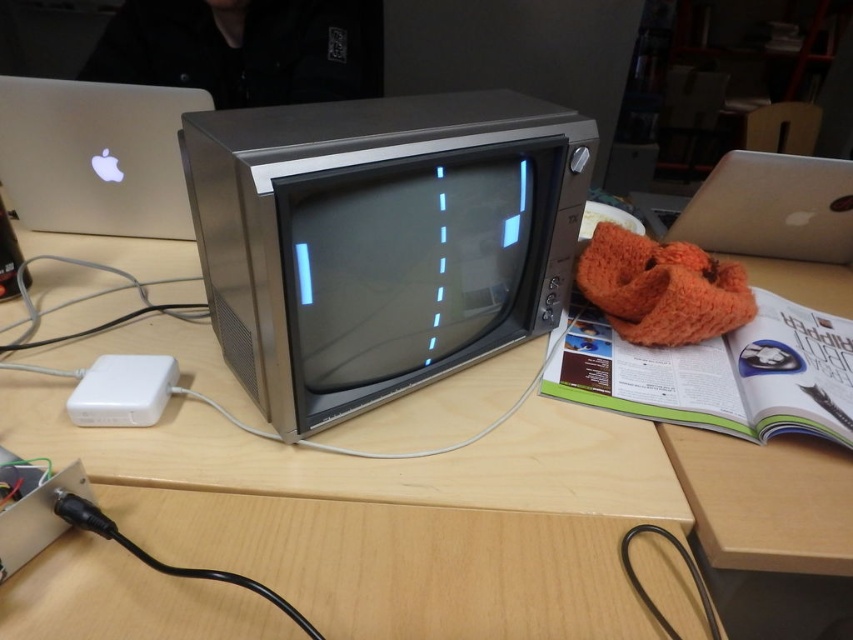
You are holding a 12 inch ruler and want to measure the distance from the camera to the point at coordinates point (38, 156). Can you determine if the ruler will be sufficient to measure this distance?

The point at coordinates point (38, 156) is 35.98 inches away from the camera. Since the ruler is only 12 inches long, it is not long enough to measure the distance. You will need a longer measuring tool.

You are setting up a workspace and need to place the silver metallic laptop at upper right on the metallic wood desk at center. Is there enough space for the laptop on the desk?

The metallic wood desk at center is positioned under the silver metallic laptop at upper right, which means the laptop is already placed on the desk. Therefore, there is sufficient space.